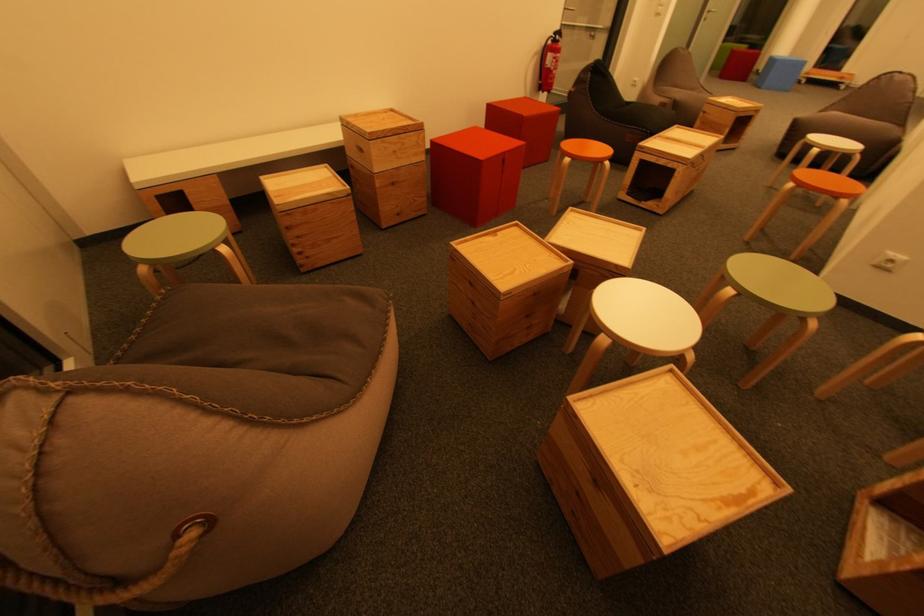
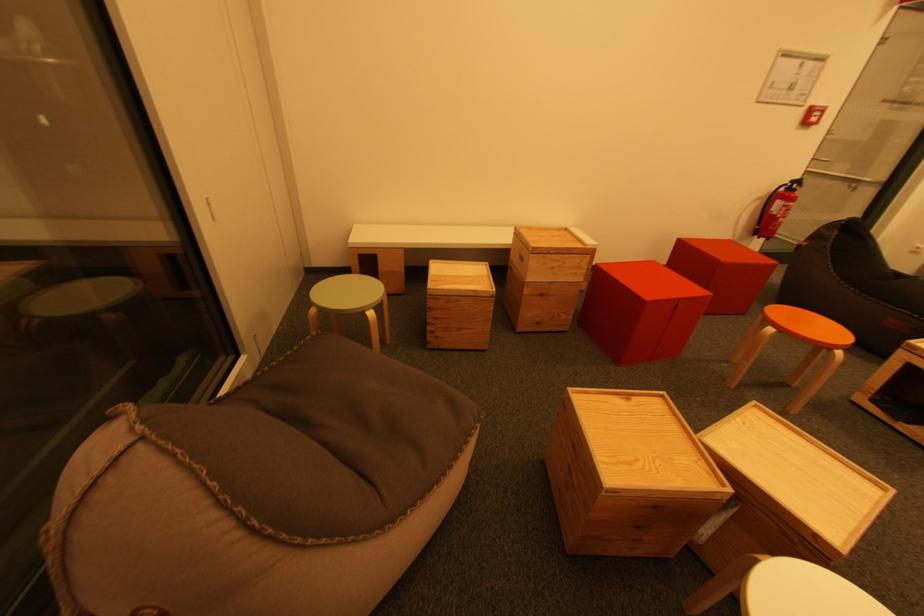
Question: The camera is either moving clockwise (left) or counter-clockwise (right) around the object. The first image is from the beginning of the video and the second image is from the end. Is the camera moving left or right when shooting the video?

Choices:
 (A) Left
 (B) Right

Answer: (B)